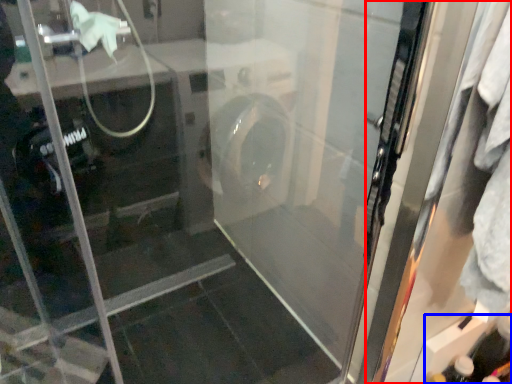
Question: Among these objects, which one is farthest to the camera, screen door (highlighted by a red box) or bottle (highlighted by a blue box)?

Choices:
 (A) screen door
 (B) bottle

Answer: (B)